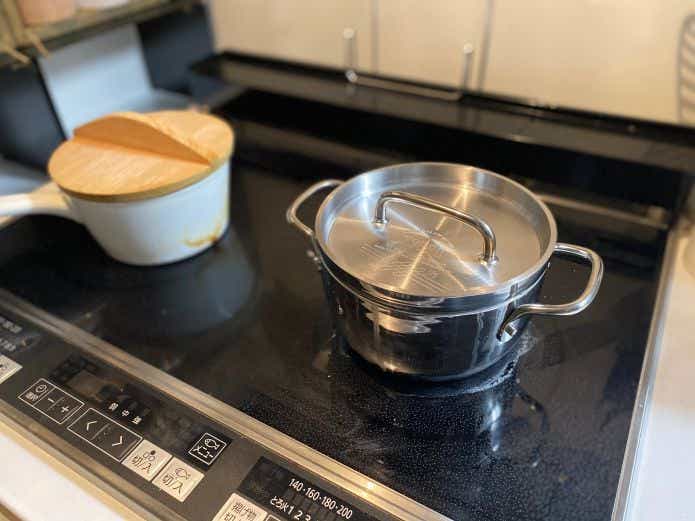
You are a GUI agent. You are given a task and a screenshot of the screen. Output one action in this format:
    pyautogui.click(x=<x>, y=<y>)
    Task: Click on the steel pot
    The height and width of the screenshot is (521, 695).
    Given the screenshot: What is the action you would take?
    pyautogui.click(x=436, y=334)